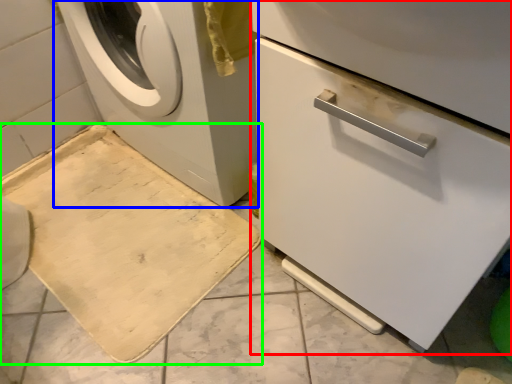
Question: Which is nearer to the machine (highlighted by a red box)? washing machine (highlighted by a blue box) or bath mat (highlighted by a green box).

Choices:
 (A) washing machine
 (B) bath mat

Answer: (A)